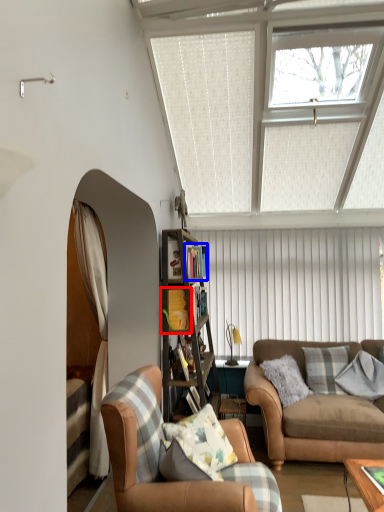
Question: Which object appears farthest to the camera in this image, shelf (highlighted by a red box) or shelf (highlighted by a blue box)?

Choices:
 (A) shelf
 (B) shelf

Answer: (B)